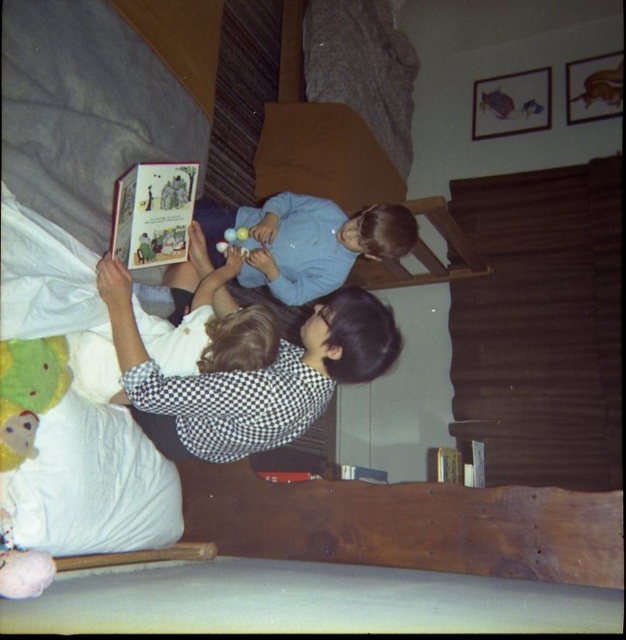
You are a delivery robot with a 12 inch wide package. You need to place the package between the hardcover book at center and the green plush mouse at lower left. Is there enough space?

The distance between the hardcover book at center and the green plush mouse at lower left is 17.95 inches, so yes, the 12 inch wide package can fit between them since the space is larger than the package.

Based on the coordinates provided, which object is located at point (305, 241)?

The point (305, 241) marks the location of the light blue fabric at center.

You are an interior designer assessing the layout of this vintage bedroom. You notice the light blue fabric at center and the hardcover book at center. Which object occupies a greater vertical space in the scene?

The light blue fabric at center is taller than the hardcover book at center, so it occupies more vertical space.